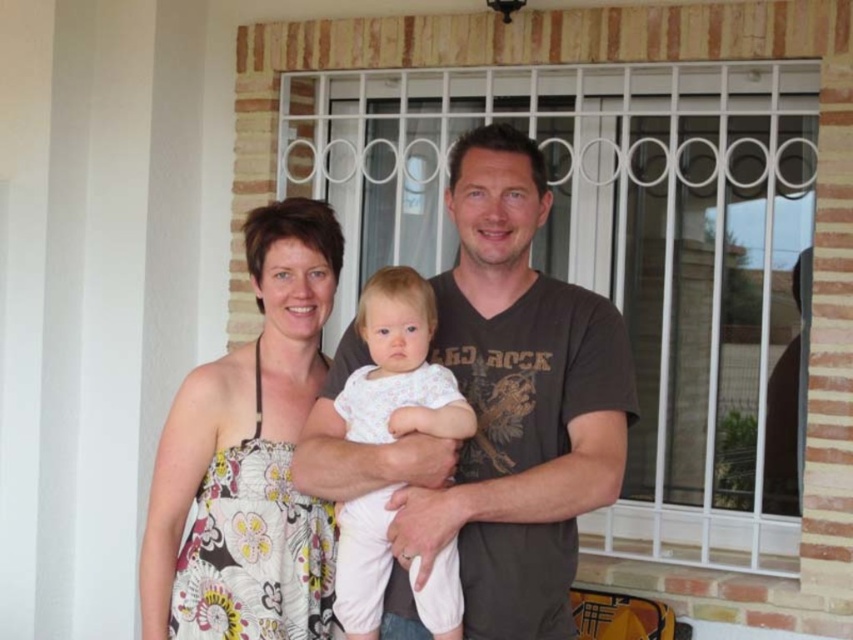
Question: Which of these objects is positioned closest to the floral dress at center?

Choices:
 (A) white cotton baby at center
 (B) white metal screen door at center

Answer: (A)

Question: Considering the relative positions of white metal screen door at center and floral dress at center in the image provided, where is white metal screen door at center located with respect to floral dress at center?

Choices:
 (A) above
 (B) below

Answer: (A)

Question: Which of the following is the farthest from the observer?

Choices:
 (A) white metal screen door at center
 (B) white cotton baby at center

Answer: (A)

Question: Which point is closer to the camera?

Choices:
 (A) floral dress at center
 (B) white cotton baby at center

Answer: (A)

Question: Does white metal screen door at center appear over white cotton baby at center?

Choices:
 (A) no
 (B) yes

Answer: (B)

Question: Does floral dress at center appear under white cotton baby at center?

Choices:
 (A) no
 (B) yes

Answer: (A)